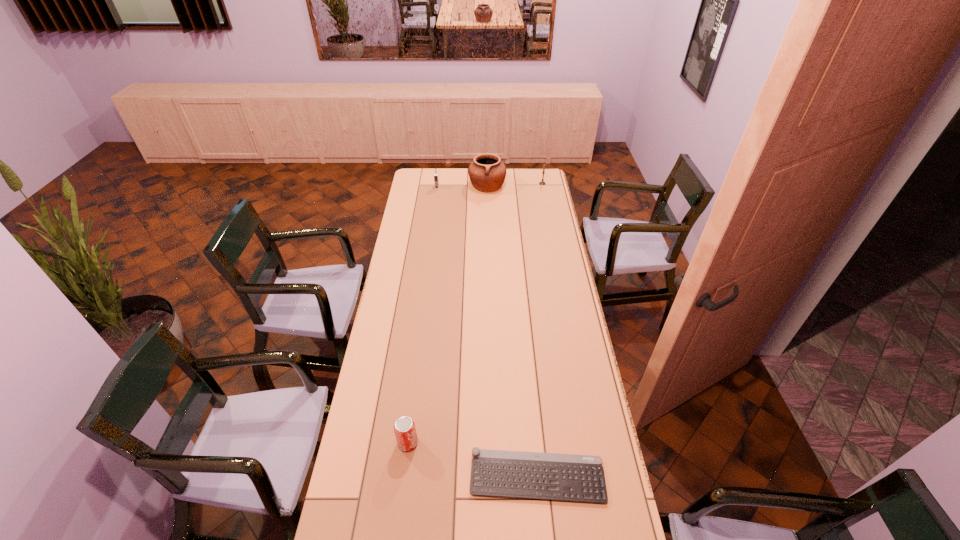
At what (x,y) coordinates should I click in order to perform the action: click on pottery situated at the far edge. Please return your answer as a coordinate pair (x, y). The image size is (960, 540). Looking at the image, I should click on (487, 173).

You are a GUI agent. You are given a task and a screenshot of the screen. Output one action in this format:
    pyautogui.click(x=<x>, y=<y>)
    Task: Click on the cellular telephone that is at the far edge
    
    Given the screenshot: What is the action you would take?
    pyautogui.click(x=436, y=180)

This screenshot has height=540, width=960. I want to click on candle that is at the far edge, so click(543, 172).

What are the coordinates of `cellular telephone located at the left edge` in the screenshot? It's located at (436, 180).

The image size is (960, 540). In order to click on soda can present at the left edge in this screenshot , I will do `click(404, 428)`.

Locate an element on the screen. candle that is at the right edge is located at coordinates (543, 172).

Where is `computer keyboard that is at the right edge`? The image size is (960, 540). computer keyboard that is at the right edge is located at coordinates (533, 475).

Where is `object present at the far left corner`? The width and height of the screenshot is (960, 540). object present at the far left corner is located at coordinates (436, 180).

The height and width of the screenshot is (540, 960). What are the coordinates of `object that is at the far right corner` in the screenshot? It's located at (543, 172).

This screenshot has height=540, width=960. I want to click on free point at the far edge, so click(512, 186).